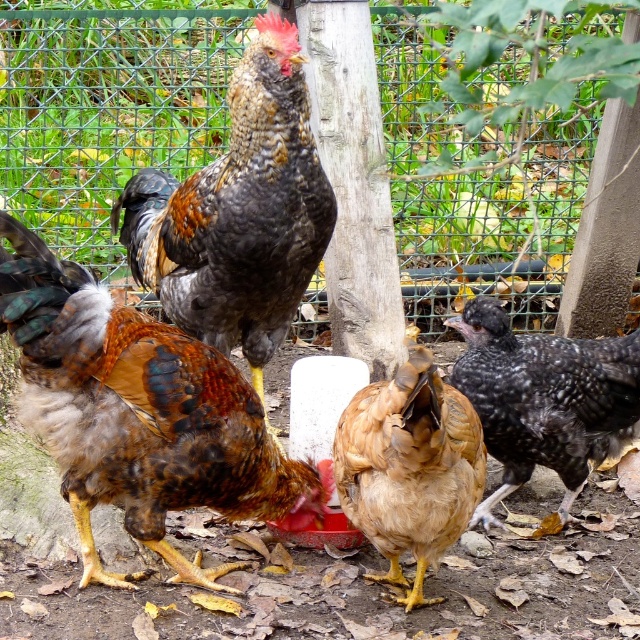
Question: Estimate the real-world distances between objects in this image. Which object is closer to the golden feathered chicken at center?

Choices:
 (A) speckled black chicken at right
 (B) speckled feathered rooster at center
 (C) brown speckled feathers at center

Answer: (C)

Question: Which object is farther from the camera taking this photo?

Choices:
 (A) speckled feathered rooster at center
 (B) speckled black chicken at right
 (C) golden feathered chicken at center
 (D) brown speckled feathers at center

Answer: (B)

Question: Is the position of speckled black chicken at right less distant than that of golden feathered chicken at center?

Choices:
 (A) yes
 (B) no

Answer: (B)

Question: Can you confirm if speckled feathered rooster at center is wider than speckled black chicken at right?

Choices:
 (A) no
 (B) yes

Answer: (B)

Question: Which of the following is the farthest from the observer?

Choices:
 (A) (436, 545)
 (B) (83, 356)
 (C) (486, 504)

Answer: (C)

Question: Is brown speckled feathers at center further to the viewer compared to speckled feathered rooster at center?

Choices:
 (A) yes
 (B) no

Answer: (B)